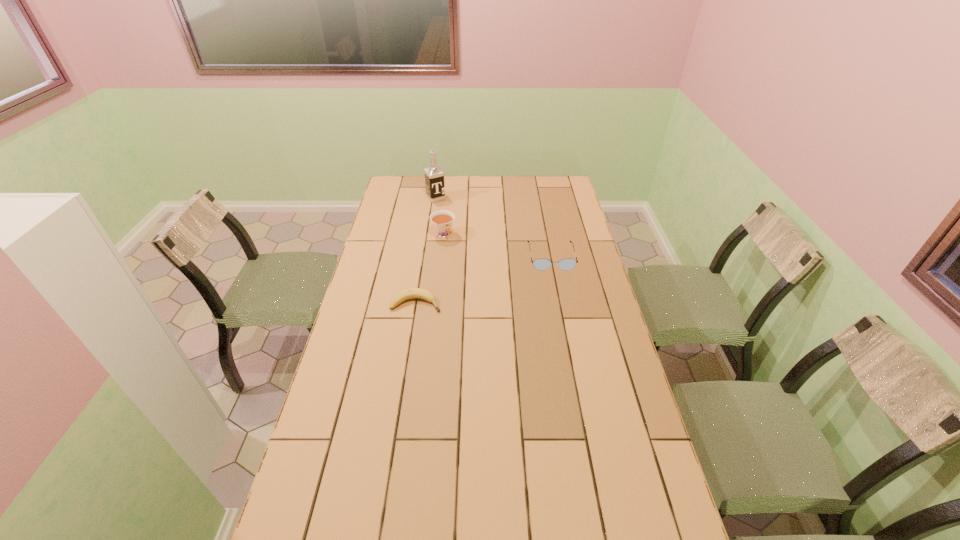
At what (x,y) coordinates should I click in order to perform the action: click on vacant space located on the side of the third nearest object with the handle. Please return your answer as a coordinate pair (x, y). The height and width of the screenshot is (540, 960). Looking at the image, I should click on (486, 289).

At what (x,y) coordinates should I click in order to perform the action: click on free space located on the side of the third nearest object with the handle. Please return your answer as a coordinate pair (x, y). Looking at the image, I should click on (493, 299).

You are a GUI agent. You are given a task and a screenshot of the screen. Output one action in this format:
    pyautogui.click(x=<x>, y=<y>)
    Task: Click on the vacant position located on the side of the third nearest object with the handle
    
    Given the screenshot: What is the action you would take?
    (488, 291)

I want to click on free region located on the front label of the farthest object, so click(450, 214).

Identify the location of vacant position located 0.200m on the front label of the farthest object. This screenshot has width=960, height=540. (458, 223).

The height and width of the screenshot is (540, 960). Identify the location of vacant space located 0.400m on the front label of the farthest object. (478, 247).

You are a GUI agent. You are given a task and a screenshot of the screen. Output one action in this format:
    pyautogui.click(x=<x>, y=<y>)
    Task: Click on the object present at the far edge
    
    Given the screenshot: What is the action you would take?
    pyautogui.click(x=434, y=176)

Where is `object at the left edge`? object at the left edge is located at coordinates (412, 293).

In order to click on object that is at the right edge in this screenshot , I will do `click(540, 264)`.

In the image, there is a desktop. Where is `vacant area at the far edge`? vacant area at the far edge is located at coordinates (534, 176).